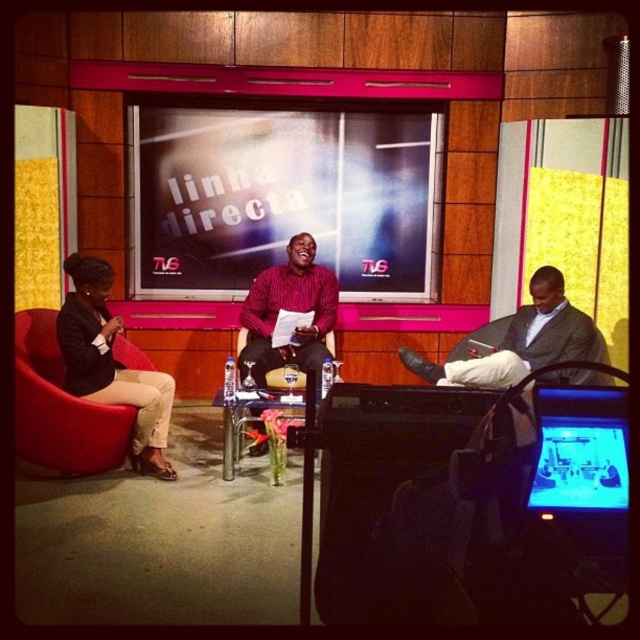
Question: Is matte red shirt at center further to camera compared to blue glossy monitor at center?

Choices:
 (A) yes
 (B) no

Answer: (A)

Question: Can you confirm if light brown leather jacket at center is smaller than black leather armchair at center?

Choices:
 (A) yes
 (B) no

Answer: (B)

Question: Which of these objects is positioned closest to the matte black jacket at left?

Choices:
 (A) matte red shirt at center
 (B) light brown leather jacket at center

Answer: (A)

Question: Based on their relative distances, which object is nearer to the light brown leather jacket at center?

Choices:
 (A) matte red shirt at center
 (B) matte black jacket at left
 (C) black leather armchair at center
 (D) blue glossy monitor at center

Answer: (A)

Question: Is matte red shirt at center smaller than black leather armchair at center?

Choices:
 (A) no
 (B) yes

Answer: (A)

Question: Which object is positioned farthest from the matte black jacket at left?

Choices:
 (A) matte red shirt at center
 (B) light brown leather jacket at center
 (C) black leather armchair at center

Answer: (B)